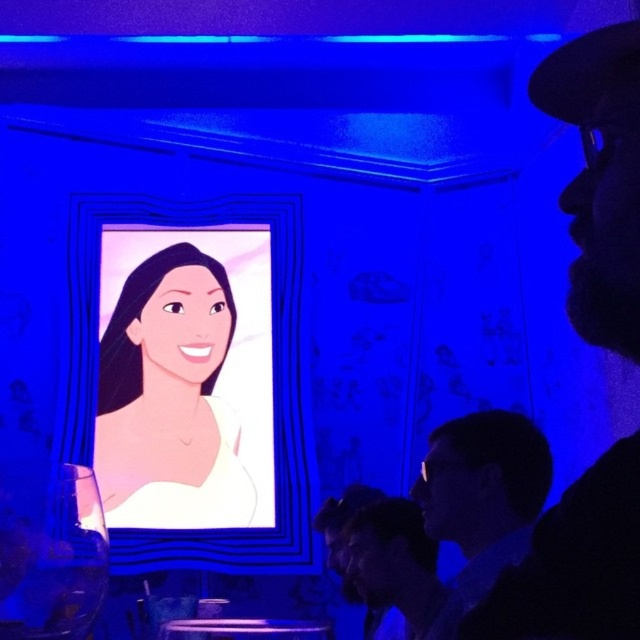
Question: Does matte black hat at upper right appear on the right side of smooth cream dress at center?

Choices:
 (A) no
 (B) yes

Answer: (B)

Question: Does smooth cream dress at center have a greater width compared to matte black hair at lower right?

Choices:
 (A) no
 (B) yes

Answer: (B)

Question: Which of the following is the farthest from the observer?

Choices:
 (A) matte black hat at upper right
 (B) smooth cream dress at center

Answer: (B)

Question: Which point is closer to the camera taking this photo?

Choices:
 (A) (234, 444)
 (B) (618, 532)

Answer: (B)

Question: Among these points, which one is farthest from the camera?

Choices:
 (A) (627, 577)
 (B) (451, 477)
 (C) (113, 490)

Answer: (C)

Question: Does smooth cream dress at center have a smaller size compared to matte black hair at lower right?

Choices:
 (A) yes
 (B) no

Answer: (B)